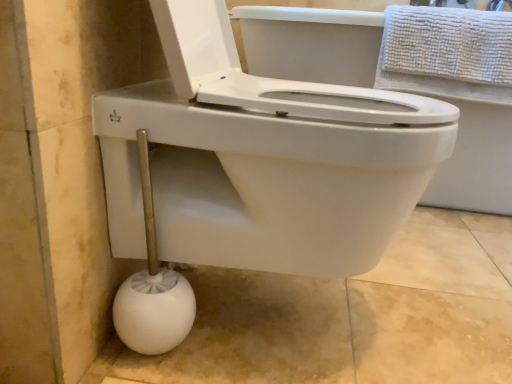
Question: Can you see white plastic toilet brush at lower left touching white textured towel at upper right?

Choices:
 (A) no
 (B) yes

Answer: (A)

Question: Does white plastic toilet brush at lower left appear on the right side of white textured towel at upper right?

Choices:
 (A) no
 (B) yes

Answer: (A)

Question: From a real-world perspective, is white plastic toilet brush at lower left physically below white textured towel at upper right?

Choices:
 (A) no
 (B) yes

Answer: (B)

Question: Can you confirm if white plastic toilet brush at lower left is bigger than white textured towel at upper right?

Choices:
 (A) yes
 (B) no

Answer: (B)

Question: Is white plastic toilet brush at lower left not within white textured towel at upper right?

Choices:
 (A) yes
 (B) no

Answer: (A)

Question: From a real-world perspective, does white plastic toilet brush at lower left stand above white textured towel at upper right?

Choices:
 (A) no
 (B) yes

Answer: (A)

Question: Does white textured towel at upper right turn towards white plastic toilet brush at lower left?

Choices:
 (A) yes
 (B) no

Answer: (B)

Question: Does white textured towel at upper right have a smaller size compared to white plastic toilet brush at lower left?

Choices:
 (A) yes
 (B) no

Answer: (B)

Question: Is the depth of white textured towel at upper right less than that of white plastic toilet brush at lower left?

Choices:
 (A) yes
 (B) no

Answer: (B)

Question: Does white textured towel at upper right have a lesser height compared to white plastic toilet brush at lower left?

Choices:
 (A) yes
 (B) no

Answer: (A)

Question: Is white textured towel at upper right thinner than white plastic toilet brush at lower left?

Choices:
 (A) no
 (B) yes

Answer: (A)

Question: From the image's perspective, does white textured towel at upper right appear higher than white plastic toilet brush at lower left?

Choices:
 (A) no
 (B) yes

Answer: (B)

Question: In the image, is white plastic toilet brush at lower left on the left side or the right side of white textured towel at upper right?

Choices:
 (A) left
 (B) right

Answer: (A)